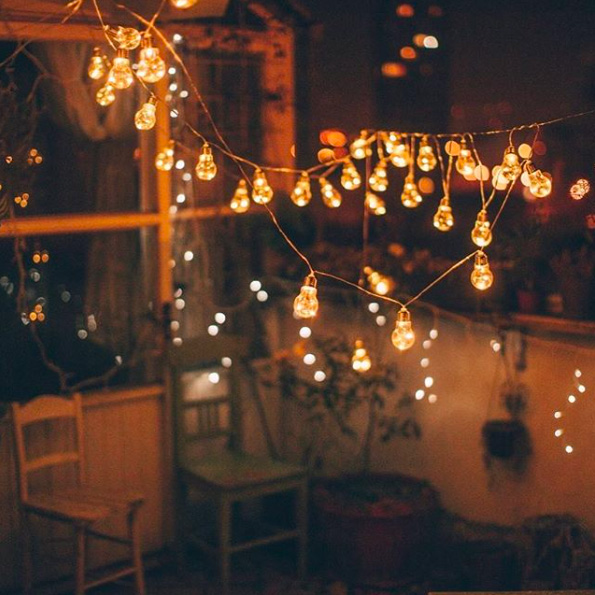
Identify the location of wood structure. (169, 236), (131, 214), (79, 32), (243, 34), (290, 112), (215, 211).